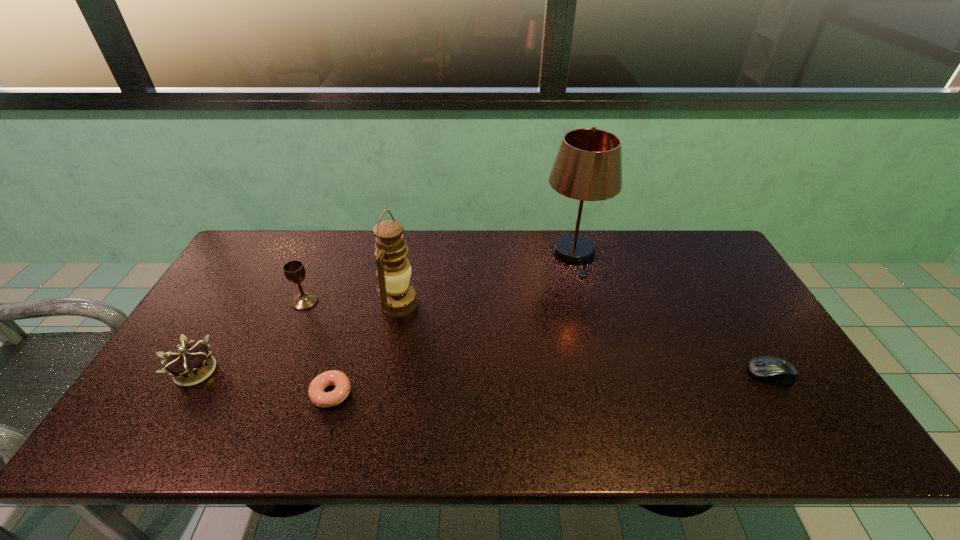
The image size is (960, 540). What are the coordinates of `free spot between the chalice and the leftmost object` in the screenshot? It's located at (251, 336).

Find the location of `free point between the oil lamp and the mouse`. free point between the oil lamp and the mouse is located at coordinates (585, 339).

Identify the location of empty space between the doughnut and the leftmost object. This screenshot has height=540, width=960. [x=263, y=382].

Find the location of a particular element. Image resolution: width=960 pixels, height=540 pixels. free spot between the doughnut and the lampshade is located at coordinates (452, 324).

Where is `the closest object relative to the mouse`? the closest object relative to the mouse is located at coordinates (588, 167).

At what (x,y) coordinates should I click in order to perform the action: click on object that stands as the fifth closest to the doughnut. Please return your answer as a coordinate pair (x, y). Looking at the image, I should click on tap(772, 370).

Locate an element on the screen. The height and width of the screenshot is (540, 960). free spot that satisfies the following two spatial constraints: 1. on the front-facing side of the mouse; 2. on the left side of the tallest object is located at coordinates (605, 375).

Find the location of `vacant space that satisfies the following two spatial constraints: 1. on the front side of the third object from left to right; 2. on the left side of the crown`. vacant space that satisfies the following two spatial constraints: 1. on the front side of the third object from left to right; 2. on the left side of the crown is located at coordinates (182, 393).

Locate an element on the screen. free space that satisfies the following two spatial constraints: 1. on the front side of the mouse; 2. on the right side of the crown is located at coordinates (193, 375).